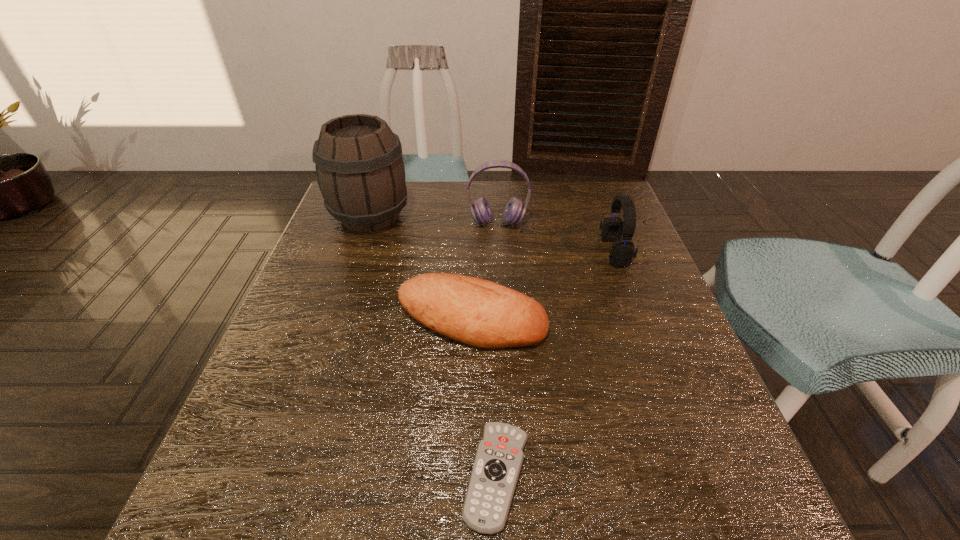
The image size is (960, 540). What are the coordinates of `object that stands as the third closest to the taller headset` in the screenshot? It's located at (477, 312).

At what (x,y) coordinates should I click in order to perform the action: click on object that is the nearest to the fourth farthest object. Please return your answer as a coordinate pair (x, y). The image size is (960, 540). Looking at the image, I should click on (499, 456).

In order to click on blank space that satisfies the following two spatial constraints: 1. on the front side of the fourth farthest object; 2. on the left side of the wine bucket in this screenshot , I will do `click(335, 320)`.